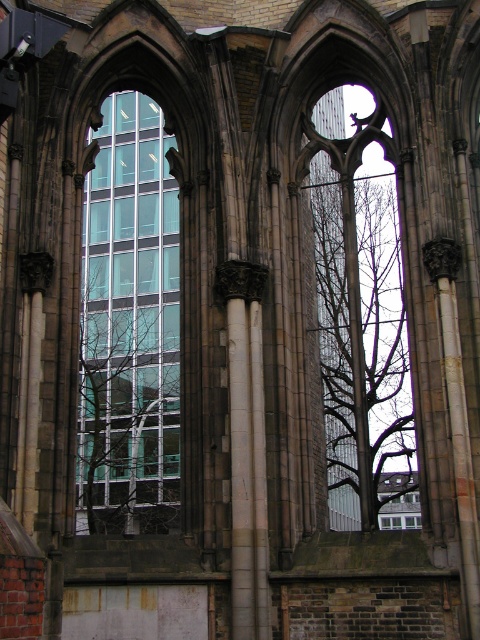
Question: Estimate the real-world distances between objects in this image. Which object is closer to the bare branches at center?

Choices:
 (A) white marble pillar at center
 (B) transparent glass building at center

Answer: (A)

Question: Estimate the real-world distances between objects in this image. Which object is farther from the bare branches at center?

Choices:
 (A) white marble pillar at center
 (B) transparent glass building at center

Answer: (B)

Question: Can you confirm if transparent glass building at center is thinner than bare branches at center?

Choices:
 (A) no
 (B) yes

Answer: (A)

Question: Does transparent glass building at center have a larger size compared to white marble pillar at center?

Choices:
 (A) no
 (B) yes

Answer: (B)

Question: Does transparent glass building at center appear on the left side of bare branches at center?

Choices:
 (A) no
 (B) yes

Answer: (B)

Question: Estimate the real-world distances between objects in this image. Which object is farther from the transparent glass building at center?

Choices:
 (A) white marble pillar at center
 (B) bare branches at center

Answer: (A)